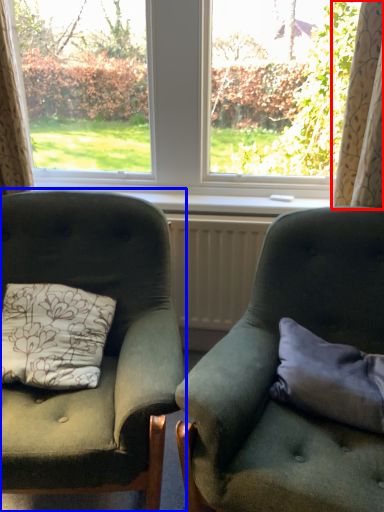
Question: Which point is further to the camera, curtain (highlighted by a red box) or chair (highlighted by a blue box)?

Choices:
 (A) curtain
 (B) chair

Answer: (A)